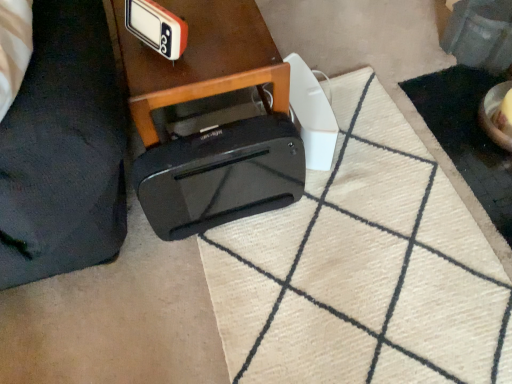
Question: Would you say black plastic toaster at lower center is part of black plastic bag at lower left's contents?

Choices:
 (A) no
 (B) yes

Answer: (A)

Question: From the image's perspective, does black plastic bag at lower left appear higher than black plastic toaster at lower center?

Choices:
 (A) no
 (B) yes

Answer: (B)

Question: Is black plastic bag at lower left thinner than black plastic toaster at lower center?

Choices:
 (A) no
 (B) yes

Answer: (A)

Question: Can you confirm if black plastic bag at lower left is taller than black plastic toaster at lower center?

Choices:
 (A) no
 (B) yes

Answer: (B)

Question: Considering the relative positions of black plastic bag at lower left and black plastic toaster at lower center in the image provided, is black plastic bag at lower left to the right of black plastic toaster at lower center from the viewer's perspective?

Choices:
 (A) no
 (B) yes

Answer: (A)

Question: Does black plastic bag at lower left appear on the left side of black plastic toaster at lower center?

Choices:
 (A) no
 (B) yes

Answer: (B)

Question: Does orange plastic clock at upper center have a greater width compared to black plastic toaster at lower center?

Choices:
 (A) yes
 (B) no

Answer: (B)

Question: Is black plastic toaster at lower center surrounded by orange plastic clock at upper center?

Choices:
 (A) no
 (B) yes

Answer: (A)

Question: Is orange plastic clock at upper center bigger than black plastic toaster at lower center?

Choices:
 (A) no
 (B) yes

Answer: (A)

Question: From a real-world perspective, is orange plastic clock at upper center below black plastic toaster at lower center?

Choices:
 (A) no
 (B) yes

Answer: (A)

Question: From a real-world perspective, is orange plastic clock at upper center on black plastic toaster at lower center?

Choices:
 (A) no
 (B) yes

Answer: (B)

Question: From the image's perspective, is orange plastic clock at upper center under black plastic toaster at lower center?

Choices:
 (A) no
 (B) yes

Answer: (A)

Question: Considering the relative sizes of black glossy printer at center and orange plastic clock at upper center in the image provided, is black glossy printer at center smaller than orange plastic clock at upper center?

Choices:
 (A) yes
 (B) no

Answer: (B)